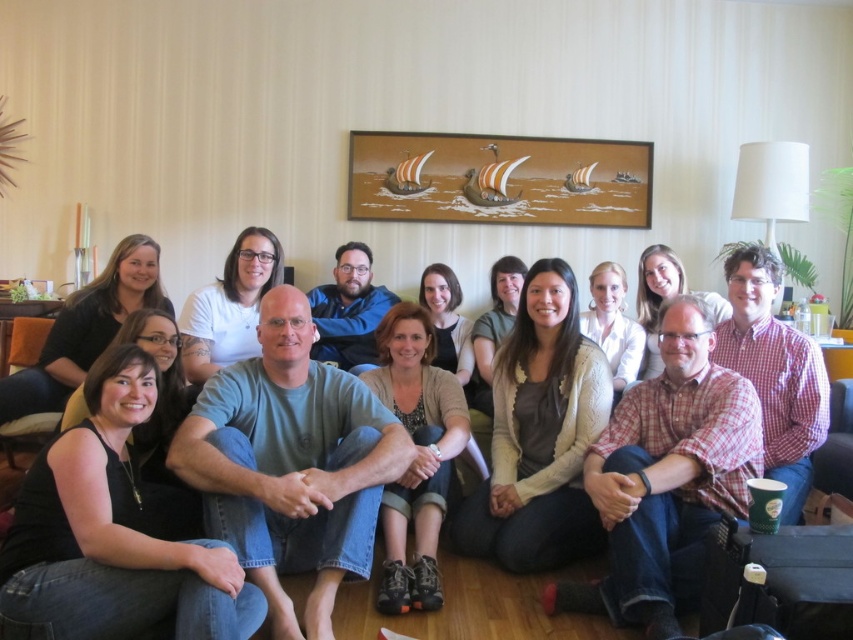
Question: Is green cotton shirt at center thinner than matte gray shirt at center?

Choices:
 (A) yes
 (B) no

Answer: (A)

Question: Is green cotton shirt at center wider than matte gray shirt at center?

Choices:
 (A) no
 (B) yes

Answer: (A)

Question: Which point is farther to the camera?

Choices:
 (A) (1, 484)
 (B) (289, 492)

Answer: (A)

Question: Is green cotton shirt at center below matte gray shirt at center?

Choices:
 (A) no
 (B) yes

Answer: (A)